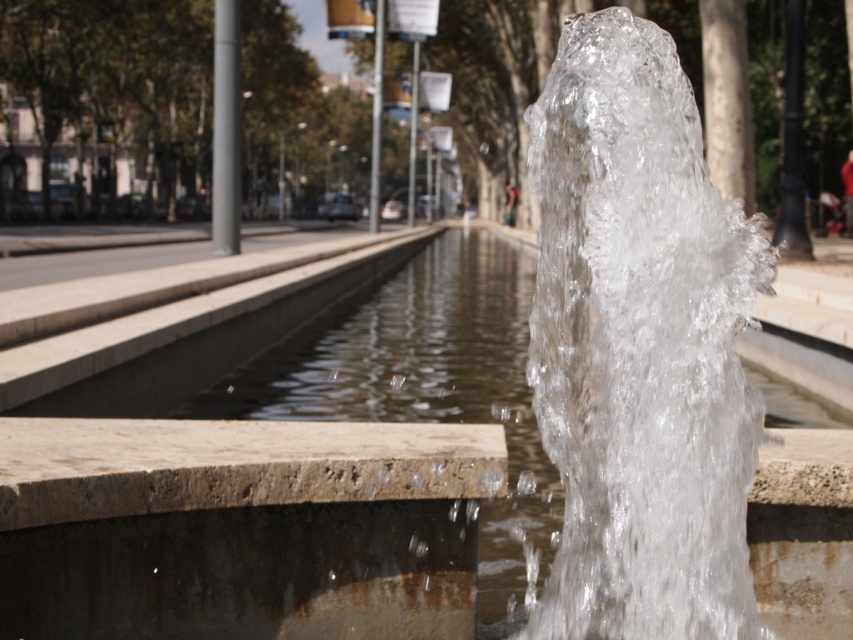
Where is `clear liquid water at center`? The image size is (853, 640). clear liquid water at center is located at coordinates (640, 346).

Between clear liquid water at center and clear water at center, which one is positioned lower?

clear liquid water at center is below.

What do you see at coordinates (640, 346) in the screenshot? I see `clear liquid water at center` at bounding box center [640, 346].

Where is `clear liquid water at center`? The width and height of the screenshot is (853, 640). clear liquid water at center is located at coordinates (640, 346).